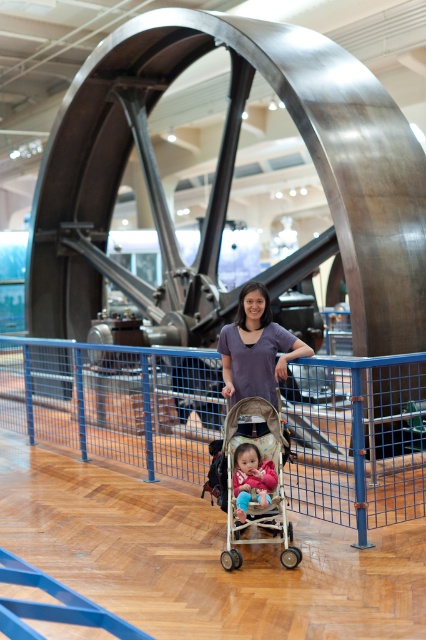
Does point (321, 436) come farther from viewer compared to point (227, 378)?

Yes, point (321, 436) is farther from viewer.

Does blue metal rail at center lie behind purple fabric shirt at center?

That is True.

Who is more distant from viewer, (379,413) or (250,294)?

The point (379,413) is behind.

Find the location of a particular element. blue metal rail at center is located at coordinates (115, 401).

Looking at this image, is blue metal rail at center bigger than pink fabric toddler at center?

No.

Describe the element at coordinates (115, 401) in the screenshot. I see `blue metal rail at center` at that location.

Find the location of `blue metal rail at center`. blue metal rail at center is located at coordinates (115, 401).

Does blue metal rail at center have a larger size compared to beige fabric stroller at center?

No.

Where is `blue metal rail at center`? blue metal rail at center is located at coordinates (115, 401).

Find the location of a particular element. blue metal rail at center is located at coordinates (115, 401).